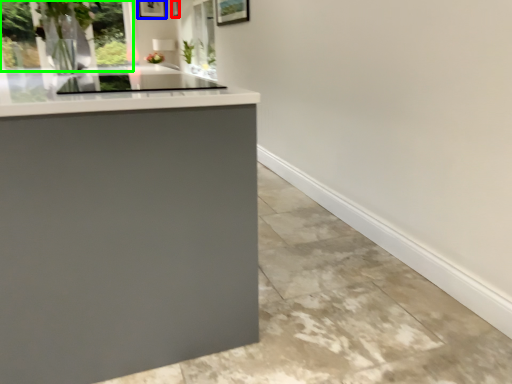
Question: Which object is positioned closest to picture frame (highlighted by a red box)? Select from picture frame (highlighted by a blue box) and window (highlighted by a green box).

Choices:
 (A) picture frame
 (B) window

Answer: (A)